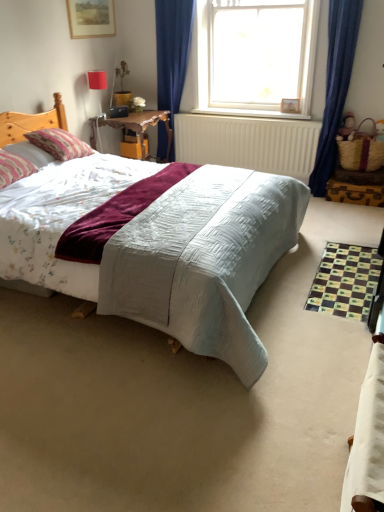
Question: Is the position of transparent glass window at upper center less distant than that of pink striped pillow at left, which is counted as the 2th pillow, starting from the back?

Choices:
 (A) no
 (B) yes

Answer: (A)

Question: Is transparent glass window at upper center thinner than pink striped pillow at left, which is counted as the 1th pillow, starting from the front?

Choices:
 (A) no
 (B) yes

Answer: (B)

Question: Is the surface of transparent glass window at upper center in direct contact with pink striped pillow at left, which is counted as the 1th pillow, starting from the front?

Choices:
 (A) no
 (B) yes

Answer: (A)

Question: Can you confirm if transparent glass window at upper center is wider than pink striped pillow at left, which is counted as the 1th pillow, starting from the front?

Choices:
 (A) no
 (B) yes

Answer: (A)

Question: Is transparent glass window at upper center oriented towards pink striped pillow at left, which is counted as the 2th pillow, starting from the back?

Choices:
 (A) yes
 (B) no

Answer: (A)

Question: Choose the correct answer: Is white fabric bed at lower right inside pink striped pillow at left, which is counted as the 2th pillow, starting from the back, or outside it?

Choices:
 (A) inside
 (B) outside

Answer: (B)

Question: Considering the relative positions of white fabric bed at lower right and pink striped pillow at left, which is counted as the 1th pillow, starting from the front, in the image provided, is white fabric bed at lower right to the left or to the right of pink striped pillow at left, which is counted as the 1th pillow, starting from the front,?

Choices:
 (A) left
 (B) right

Answer: (B)

Question: Is point (370, 452) positioned closer to the camera than point (28, 169)?

Choices:
 (A) closer
 (B) farther

Answer: (A)

Question: In terms of size, does white fabric bed at lower right appear bigger or smaller than pink striped pillow at left, which is counted as the 1th pillow, starting from the front?

Choices:
 (A) big
 (B) small

Answer: (A)

Question: Do you think matte red lampshade at upper left is within braided straw picnic basket at right, or outside of it?

Choices:
 (A) inside
 (B) outside

Answer: (B)

Question: Does point pos(97,77) appear closer or farther from the camera than point pos(360,121)?

Choices:
 (A) farther
 (B) closer

Answer: (A)

Question: Is matte red lampshade at upper left wider or thinner than braided straw picnic basket at right?

Choices:
 (A) thin
 (B) wide

Answer: (A)

Question: From the image's perspective, is matte red lampshade at upper left located above or below braided straw picnic basket at right?

Choices:
 (A) above
 (B) below

Answer: (A)

Question: In terms of size, does wooden picture frame at upper left appear bigger or smaller than braided straw picnic basket at right?

Choices:
 (A) big
 (B) small

Answer: (B)

Question: Considering the positions of point (87, 24) and point (352, 164), is point (87, 24) closer or farther from the camera than point (352, 164)?

Choices:
 (A) farther
 (B) closer

Answer: (A)